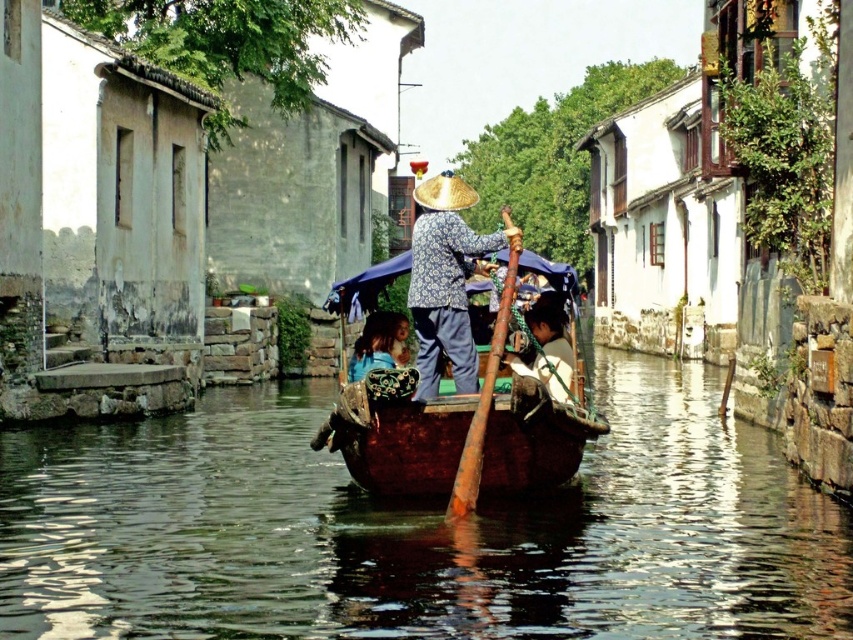
You are a tourist standing on the dock and want to board the brown wooden boat at center. There is a rusty wooden paddle at center nearby. If the dock is 50 feet long, can you reach the boat without stepping off the dock?

The brown wooden boat at center and rusty wooden paddle at center are 54.75 feet apart. Since the dock is only 50 feet long, you cannot reach the boat without stepping off the dock.

You are a tourist standing on the canal bank and want to take a photo of the wooden boat at center and the golden straw hat at center. Which object should you focus on first to ensure both are in the frame?

You should focus on the wooden boat at center first because it is in front of the golden straw hat at center, so it will be closer to your camera and easier to frame both objects together.